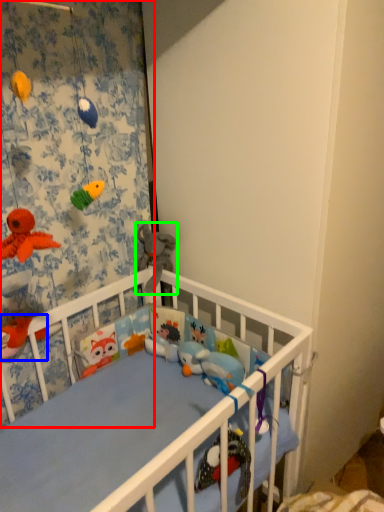
Question: Based on their relative distances, which object is farther from curtain (highlighted by a red box)? Choose from toy (highlighted by a blue box) and toy (highlighted by a green box).

Choices:
 (A) toy
 (B) toy

Answer: (A)